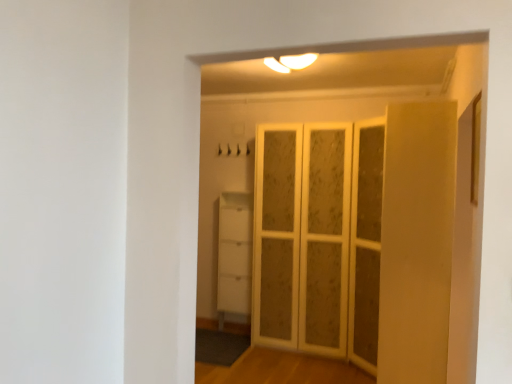
Question: From a real-world perspective, is white textured screen door at center positioned above or below white matte cabinet at lower center?

Choices:
 (A) above
 (B) below

Answer: (A)

Question: Considering their positions, is white textured screen door at center located in front of or behind white matte cabinet at lower center?

Choices:
 (A) front
 (B) behind

Answer: (A)

Question: From the image's perspective, is white textured screen door at center positioned above or below white matte cabinet at lower center?

Choices:
 (A) below
 (B) above

Answer: (B)

Question: Based on their sizes in the image, would you say white matte cabinet at lower center is bigger or smaller than white textured screen door at center?

Choices:
 (A) big
 (B) small

Answer: (B)

Question: From the image's perspective, is white matte cabinet at lower center positioned above or below white textured screen door at center?

Choices:
 (A) below
 (B) above

Answer: (A)

Question: Is white matte cabinet at lower center taller or shorter than white textured screen door at center?

Choices:
 (A) short
 (B) tall

Answer: (A)

Question: Do you think white matte cabinet at lower center is within white textured screen door at center, or outside of it?

Choices:
 (A) outside
 (B) inside

Answer: (A)